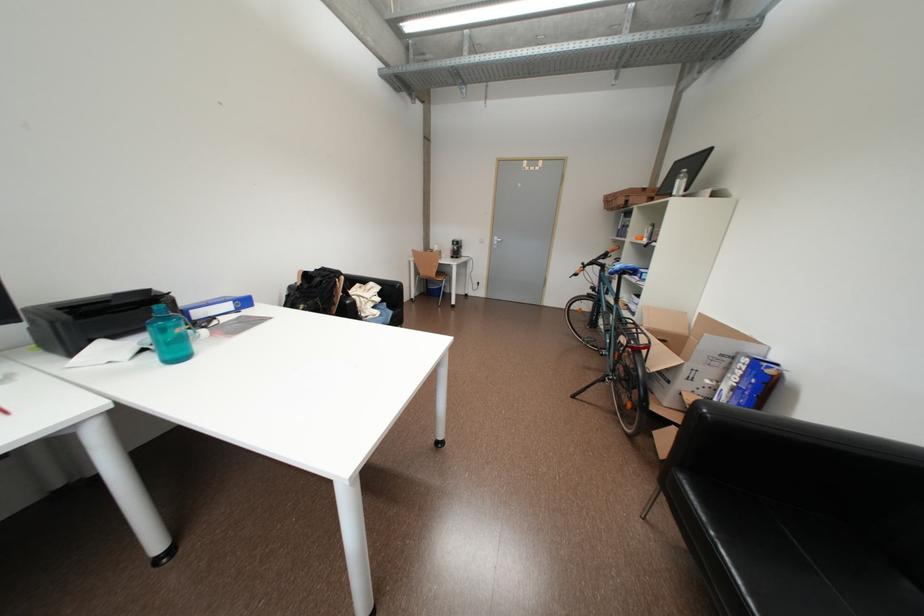
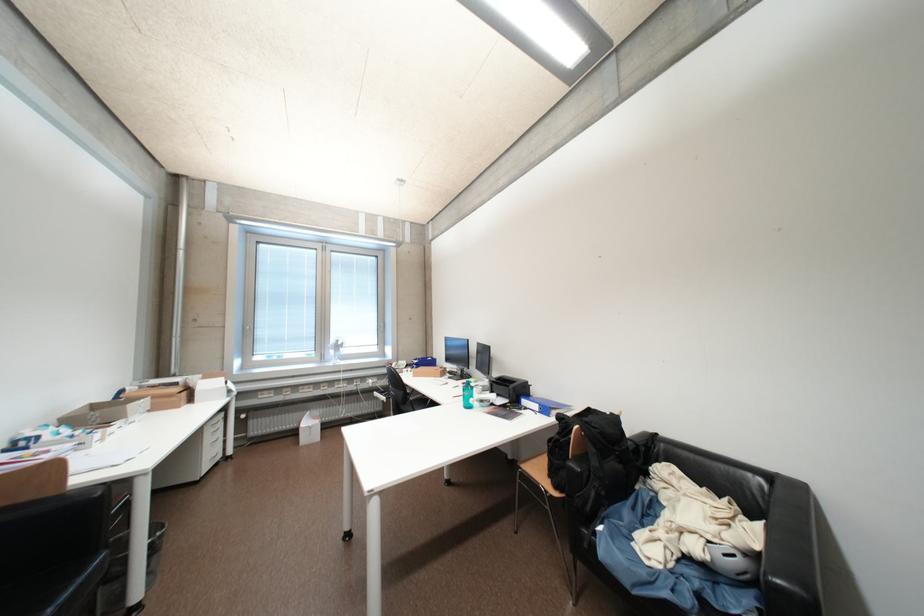
Where in the second image is the point corresponding to (261,307) from the first image?

(555, 418)